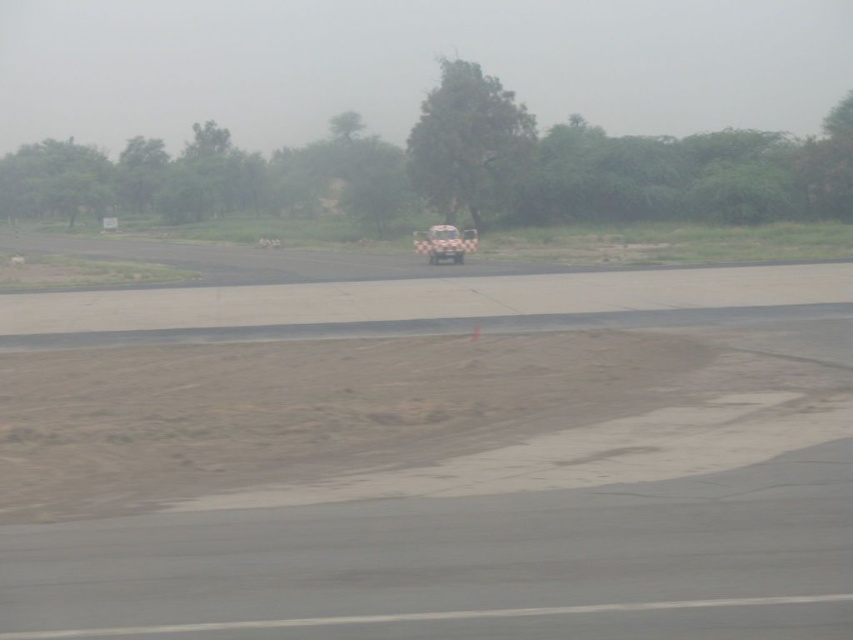
Question: Does brown sandy dirt track at lower left have a larger size compared to white checkered car at center?

Choices:
 (A) no
 (B) yes

Answer: (B)

Question: Which point appears closest to the camera in this image?

Choices:
 (A) (631, 364)
 (B) (456, 246)

Answer: (A)

Question: Can you confirm if brown sandy dirt track at lower left is positioned to the left of white checkered car at center?

Choices:
 (A) no
 (B) yes

Answer: (B)

Question: Is brown sandy dirt track at lower left bigger than white checkered car at center?

Choices:
 (A) yes
 (B) no

Answer: (A)